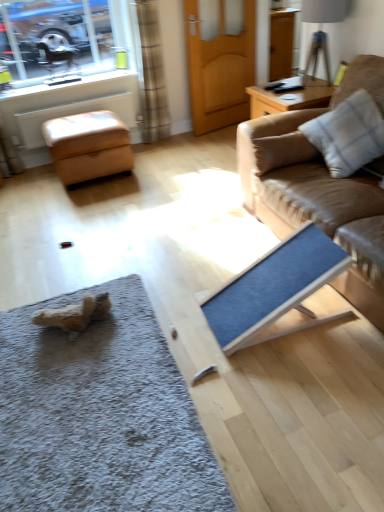
This screenshot has width=384, height=512. I want to click on vacant region in front of brown textured curtain at upper left, so click(x=161, y=148).